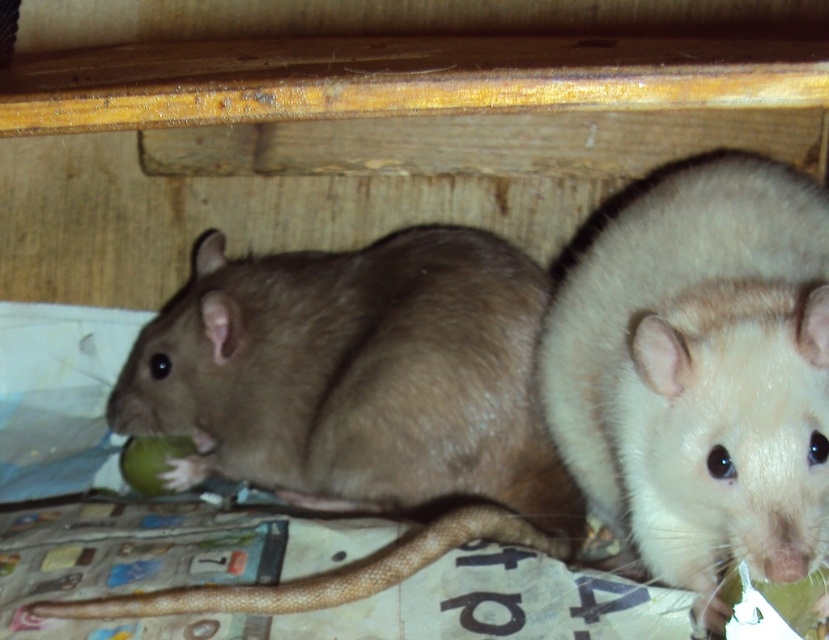
You are a zookeeper observing the enclosure. You notice the brown furry mouse at center and the light beige fur hamster at right. Which animal is positioned lower in the enclosure?

The brown furry mouse at center is positioned lower than the light beige fur hamster at right in the enclosure.

You are a veterinarian examining two rodents in an enclosure. You notice the brown furry mouse at center and the light beige fur hamster at right. Which rodent would you expect to have a larger body size based on their appearance?

The brown furry mouse at center is bigger than the light beige fur hamster at right, so the veterinarian would expect the brown furry mouse at center to have a larger body size.